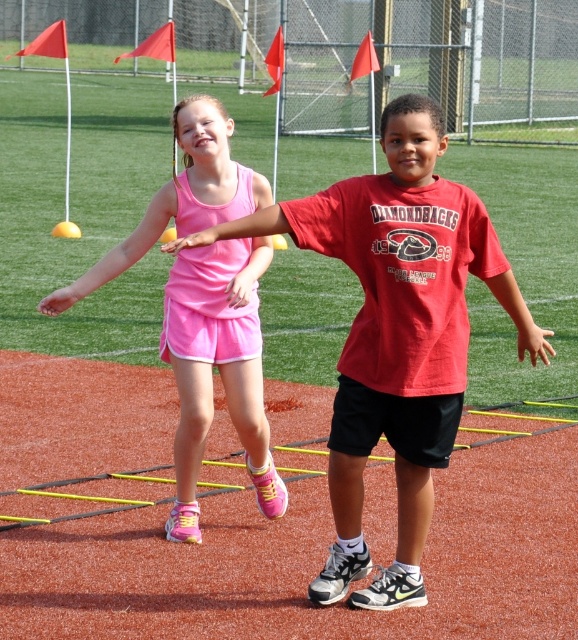
In the scene shown: Who is more distant from viewer, (x=402, y=275) or (x=166, y=285)?

Point (x=166, y=285)

Can you confirm if red matte shirt at center is smaller than matte pink tank top at center?

No.

This screenshot has height=640, width=578. Identify the location of red matte shirt at center. (395, 333).